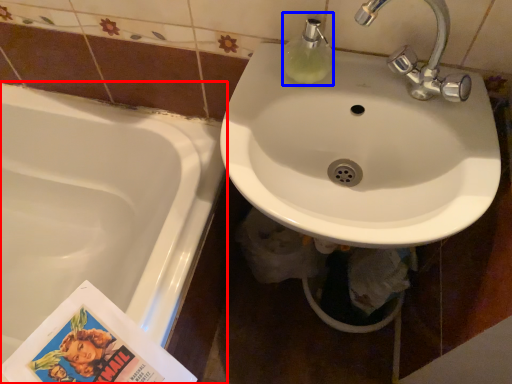
Question: Which object is further to the camera taking this photo, bathtub (highlighted by a red box) or soap dispenser (highlighted by a blue box)?

Choices:
 (A) bathtub
 (B) soap dispenser

Answer: (A)